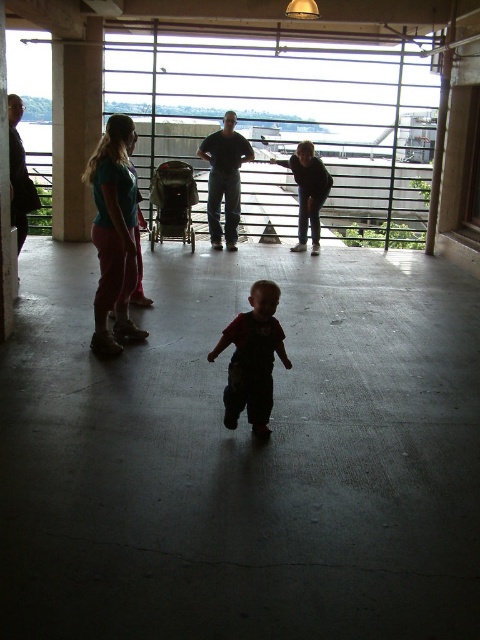
Between dark red overalls at center and green fabric stroller at center, which one has more height?

green fabric stroller at center is taller.

Is dark red overalls at center below green fabric stroller at center?

Indeed, dark red overalls at center is positioned under green fabric stroller at center.

The height and width of the screenshot is (640, 480). What do you see at coordinates (252, 358) in the screenshot?
I see `dark red overalls at center` at bounding box center [252, 358].

Identify the location of dark red overalls at center. This screenshot has height=640, width=480. [x=252, y=358].